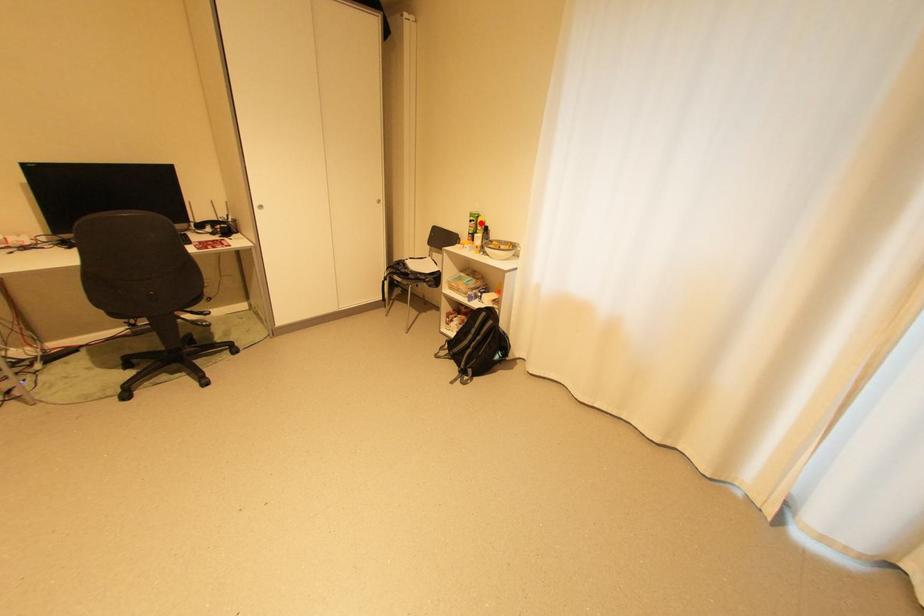
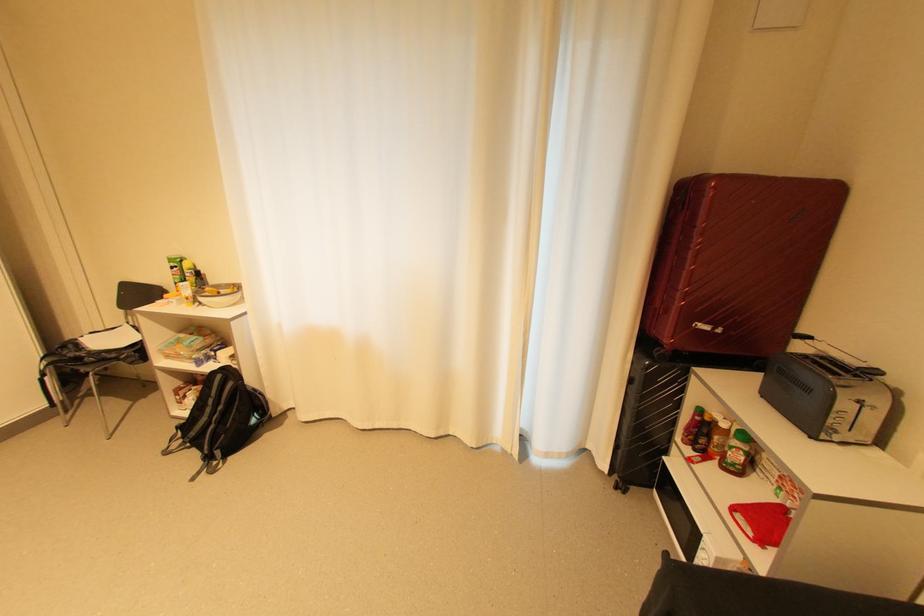
Locate, in the second image, the point that corresponds to the highlighted location in the first image.

(184, 270)